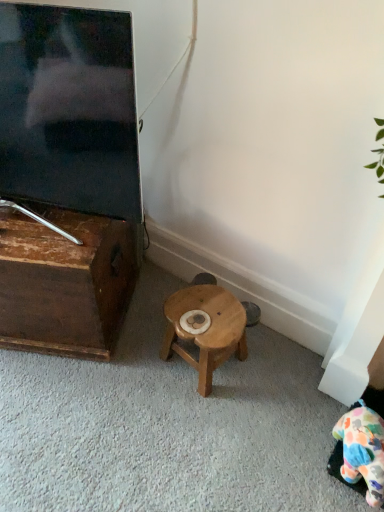
Question: Considering the positions of point [6, 308] and point [66, 177], is point [6, 308] closer or farther from the camera than point [66, 177]?

Choices:
 (A) farther
 (B) closer

Answer: (A)

Question: In terms of width, does wooden table at left look wider or thinner when compared to matte black tv at left?

Choices:
 (A) wide
 (B) thin

Answer: (A)

Question: Estimate the real-world distances between objects in this image. Which object is closer to the fluffy multicolored plush at lower right?

Choices:
 (A) wooden stool at center
 (B) matte black tv at left
 (C) wooden table at left

Answer: (A)

Question: Estimate the real-world distances between objects in this image. Which object is closer to the wooden stool at center?

Choices:
 (A) wooden table at left
 (B) fluffy multicolored plush at lower right
 (C) matte black tv at left

Answer: (A)